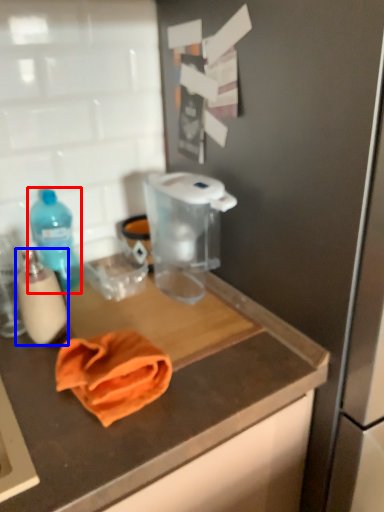
Question: Which point is further to the camera, bottle (highlighted by a red box) or bottle (highlighted by a blue box)?

Choices:
 (A) bottle
 (B) bottle

Answer: (A)